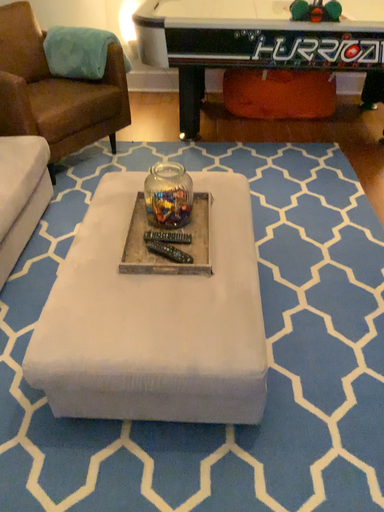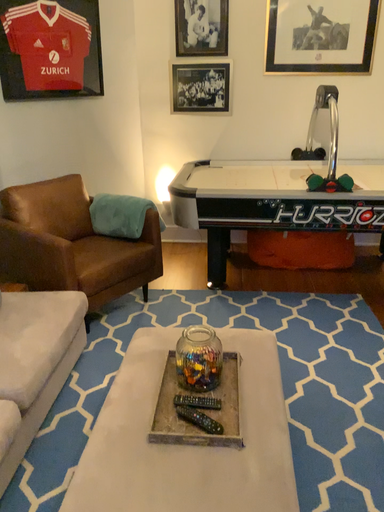
Question: How did the camera likely rotate when shooting the video?

Choices:
 (A) rotated upward
 (B) rotated downward

Answer: (A)